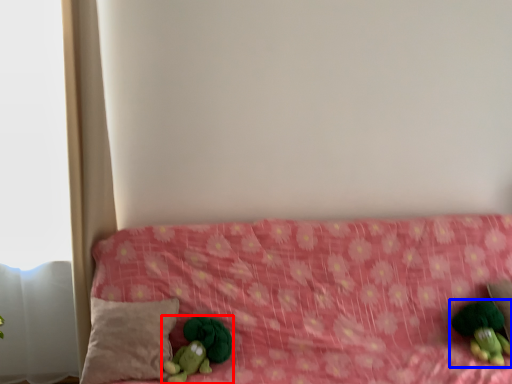
Question: Which object appears closest to the camera in this image, toy (highlighted by a red box) or toy (highlighted by a blue box)?

Choices:
 (A) toy
 (B) toy

Answer: (A)